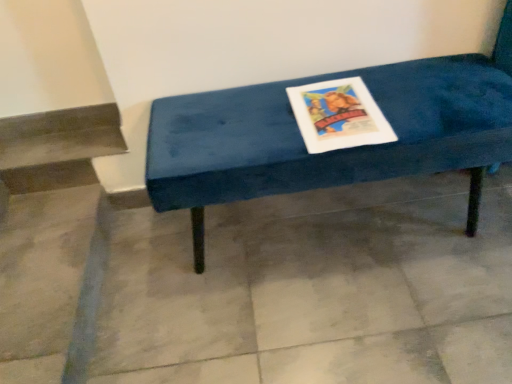
Question: From a real-world perspective, is gray tile floor at center under velvet blue bench at center?

Choices:
 (A) no
 (B) yes

Answer: (B)

Question: Is gray tile floor at center not within velvet blue bench at center?

Choices:
 (A) yes
 (B) no

Answer: (A)

Question: Is gray tile floor at center taller than velvet blue bench at center?

Choices:
 (A) yes
 (B) no

Answer: (B)

Question: Can you confirm if gray tile floor at center is shorter than velvet blue bench at center?

Choices:
 (A) no
 (B) yes

Answer: (B)

Question: Considering the relative sizes of gray tile floor at center and velvet blue bench at center in the image provided, is gray tile floor at center bigger than velvet blue bench at center?

Choices:
 (A) no
 (B) yes

Answer: (A)

Question: Does gray tile floor at center touch velvet blue bench at center?

Choices:
 (A) yes
 (B) no

Answer: (B)

Question: Can you confirm if velvet blue bench at center is bigger than gray tile floor at center?

Choices:
 (A) yes
 (B) no

Answer: (A)

Question: Does velvet blue bench at center lie behind gray tile floor at center?

Choices:
 (A) yes
 (B) no

Answer: (B)

Question: From a real-world perspective, is velvet blue bench at center located beneath gray tile floor at center?

Choices:
 (A) no
 (B) yes

Answer: (A)

Question: Does velvet blue bench at center have a greater height compared to gray tile floor at center?

Choices:
 (A) no
 (B) yes

Answer: (B)

Question: From a real-world perspective, is velvet blue bench at center positioned over gray tile floor at center based on gravity?

Choices:
 (A) no
 (B) yes

Answer: (B)

Question: Is velvet blue bench at center not within gray tile floor at center?

Choices:
 (A) no
 (B) yes

Answer: (B)

Question: Considering the relative positions of gray tile floor at center and velvet blue bench at center in the image provided, is gray tile floor at center to the left or to the right of velvet blue bench at center?

Choices:
 (A) right
 (B) left

Answer: (B)